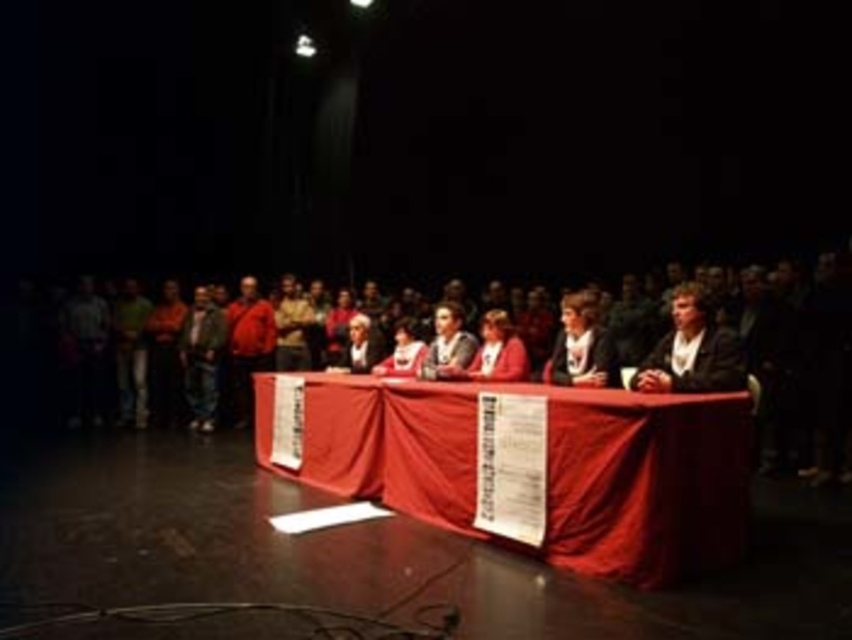
You are a stagehand preparing to move a 2.5 meter wide backdrop onto the stage. The backdrop must be placed between the matte black crowd at center and the smooth red tablecloth at center. Can the backdrop fit between them based on their widths?

The matte black crowd at center is wider than the smooth red tablecloth at center. Since the backdrop is 2.5 meters wide, it may not fit between them if the combined width of the crowd and tablecloth exceeds the available space. However, without specific measurements of the stage, it is impossible to determine definitively.

You are a photographer at the back of the theater capturing the event. You notice the matte black crowd at center and the smooth red tablecloth at center. Which object is positioned higher in the image?

The matte black crowd at center is above the smooth red tablecloth at center, so the matte black crowd at center is higher in the image.